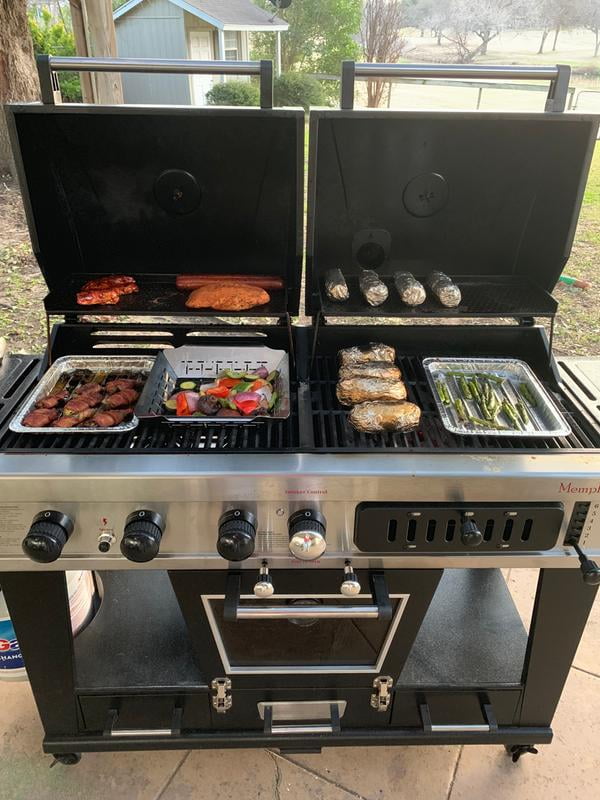
The height and width of the screenshot is (800, 600). Identify the location of knob. (265, 592).